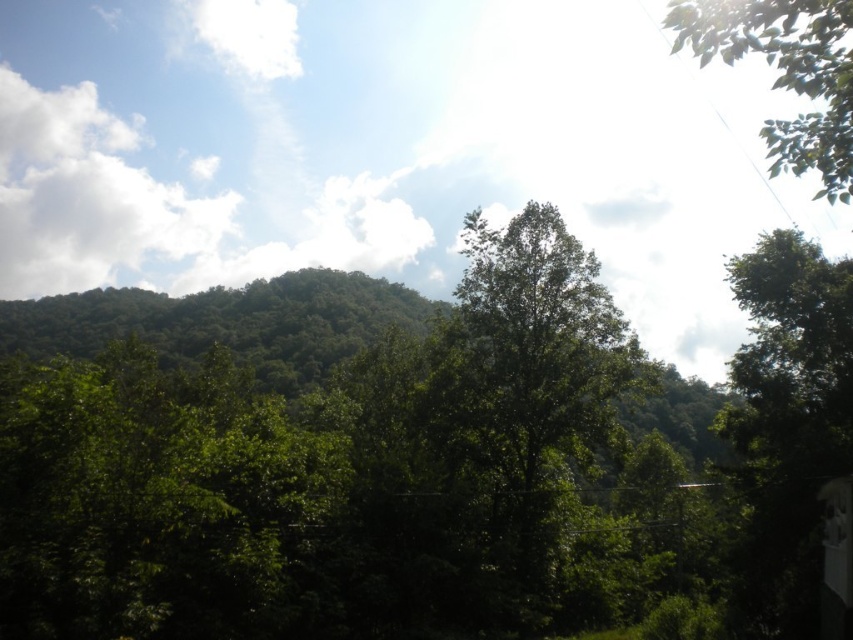
Does green leafy tree at center appear over green leafy tree at upper right?

No.

Does green leafy tree at center appear under green leafy tree at upper right?

Yes, green leafy tree at center is below green leafy tree at upper right.

Where is `green leafy tree at center`? The height and width of the screenshot is (640, 853). green leafy tree at center is located at coordinates (524, 403).